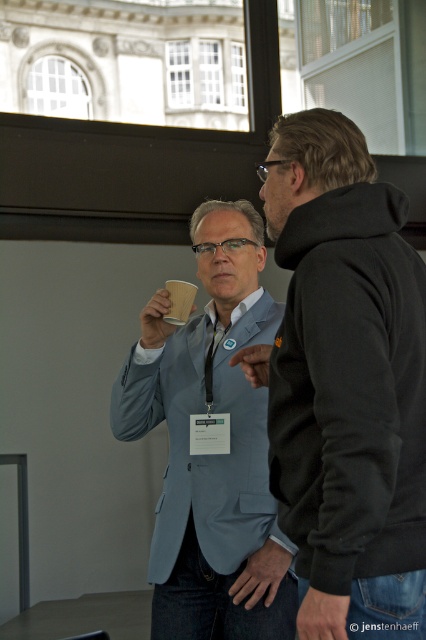
Question: Is black hoodie at right above matte black hand at center?

Choices:
 (A) no
 (B) yes

Answer: (B)

Question: Which object is the farthest from the matte black hand at center?

Choices:
 (A) black hoodie at right
 (B) brown paper cup at upper center

Answer: (A)

Question: Among these objects, which one is farthest from the camera?

Choices:
 (A) dark gray fabric hand at lower right
 (B) matte black hand at center

Answer: (B)

Question: In this image, where is dark gray fabric hand at lower right located relative to matte black hand at center?

Choices:
 (A) below
 (B) above

Answer: (A)

Question: Is matte gray blazer at center further to camera compared to matte black hand at center?

Choices:
 (A) no
 (B) yes

Answer: (B)

Question: Which point appears closest to the camera in this image?

Choices:
 (A) (258, 352)
 (B) (241, 577)
 (C) (155, 328)

Answer: (B)